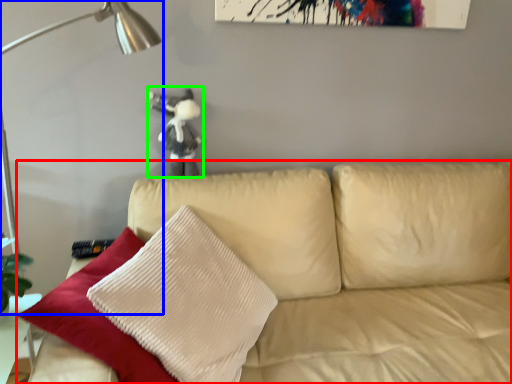
Question: Which is farther away from studio couch (highlighted by a red box)? table lamp (highlighted by a blue box) or figurine (highlighted by a green box)?

Choices:
 (A) table lamp
 (B) figurine

Answer: (A)